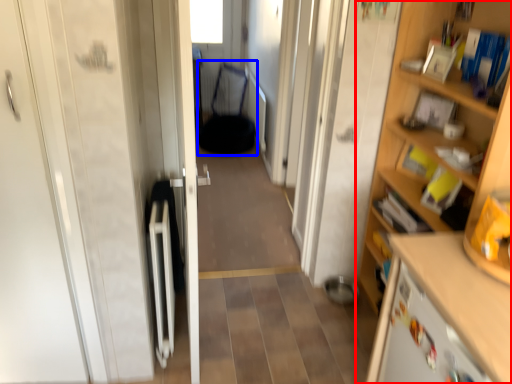
Question: Which point is closer to the camera, cupboard (highlighted by a red box) or armchair (highlighted by a blue box)?

Choices:
 (A) cupboard
 (B) armchair

Answer: (A)